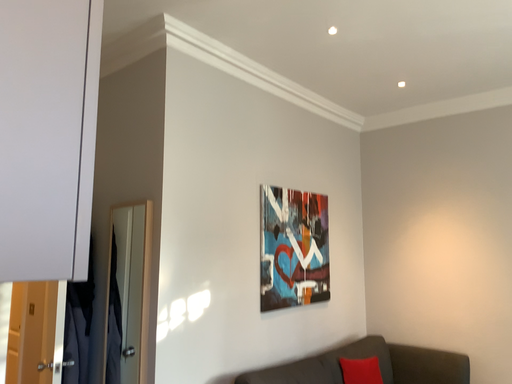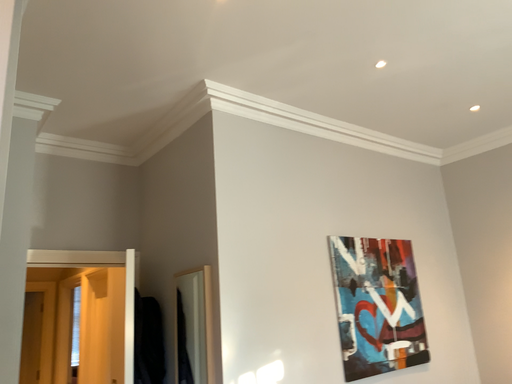
Question: Which way did the camera rotate in the video?

Choices:
 (A) rotated left
 (B) rotated right

Answer: (A)